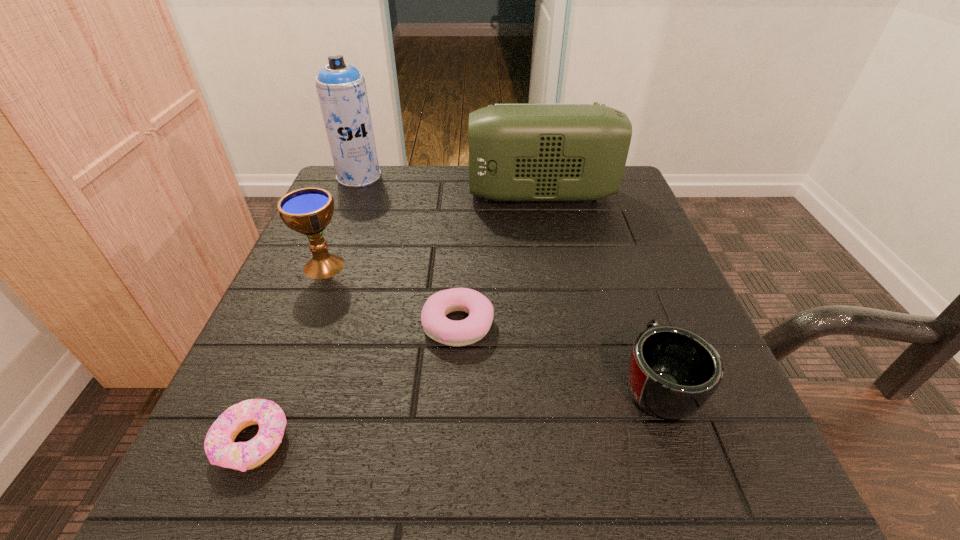
The height and width of the screenshot is (540, 960). I want to click on aerosol can, so click(341, 88).

The image size is (960, 540). I want to click on the fifth shortest object, so click(x=517, y=151).

Identify the location of chalice. This screenshot has height=540, width=960. (308, 211).

The width and height of the screenshot is (960, 540). I want to click on the fourth nearest object, so click(308, 211).

I want to click on mug, so click(672, 372).

Image resolution: width=960 pixels, height=540 pixels. I want to click on the fifth tallest object, so click(436, 325).

This screenshot has height=540, width=960. In order to click on doughnut in this screenshot , I will do `click(219, 445)`.

The width and height of the screenshot is (960, 540). I want to click on vacant space located on the front of the aerosol can, so click(348, 201).

Locate an element on the screen. vacant space situated 0.180m on the front-facing side of the radio_receiver is located at coordinates (392, 195).

The image size is (960, 540). What are the coordinates of `free space located on the front-facing side of the radio_receiver` in the screenshot? It's located at (323, 195).